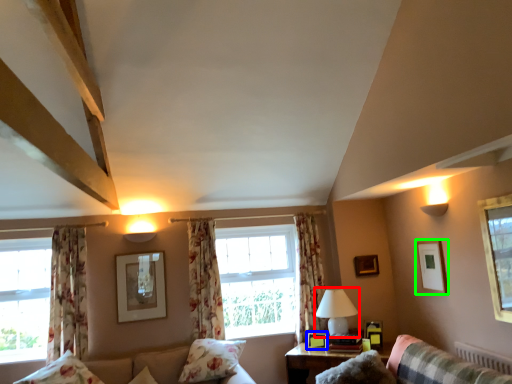
Question: Which object is positioned closest to table lamp (highlighted by a red box)? Select from picture frame (highlighted by a blue box) and picture frame (highlighted by a green box).

Choices:
 (A) picture frame
 (B) picture frame

Answer: (A)